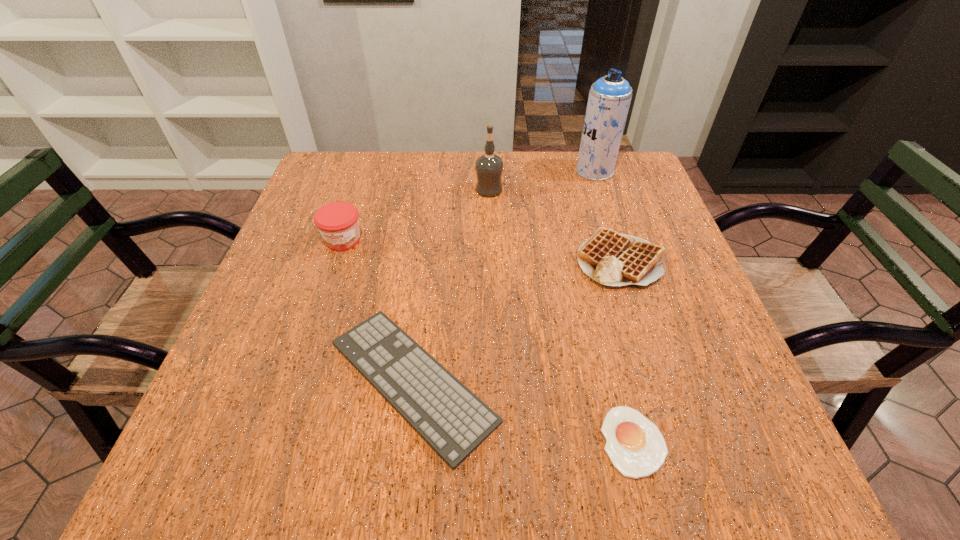
Where is `object that is at the left edge`? The image size is (960, 540). object that is at the left edge is located at coordinates click(338, 223).

Image resolution: width=960 pixels, height=540 pixels. Identify the location of aerosol can that is at the right edge. (609, 99).

Identify the location of waffle that is at the right edge. (613, 259).

Where is `egg yolk situated at the right edge`? This screenshot has width=960, height=540. egg yolk situated at the right edge is located at coordinates (636, 447).

Find the location of `object present at the far right corner`. object present at the far right corner is located at coordinates (609, 99).

At what (x,y) coordinates should I click in order to perform the action: click on object that is at the near right corner. Please return your answer as a coordinate pair (x, y). Image resolution: width=960 pixels, height=540 pixels. Looking at the image, I should click on (636, 447).

Where is `vacant space at the far edge of the desktop`? Image resolution: width=960 pixels, height=540 pixels. vacant space at the far edge of the desktop is located at coordinates (386, 181).

I want to click on vacant space at the near edge of the desktop, so click(x=318, y=450).

Locate an element on the screen. The height and width of the screenshot is (540, 960). vacant space at the left edge of the desktop is located at coordinates (276, 329).

In the image, there is a desktop. Where is `vacant space at the right edge`? This screenshot has height=540, width=960. vacant space at the right edge is located at coordinates (684, 269).